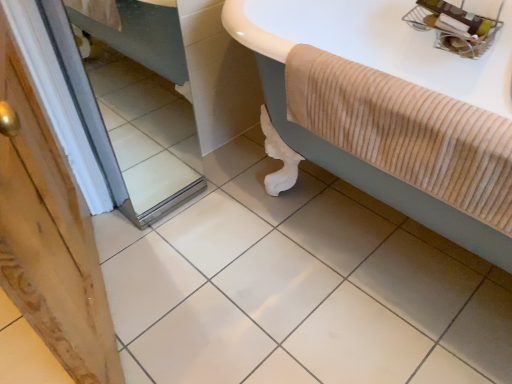
Locate an element on the screen. Image resolution: width=512 pixels, height=384 pixels. blank space situated above beige corduroy bathtub at upper right (from a real-world perspective) is located at coordinates (399, 86).